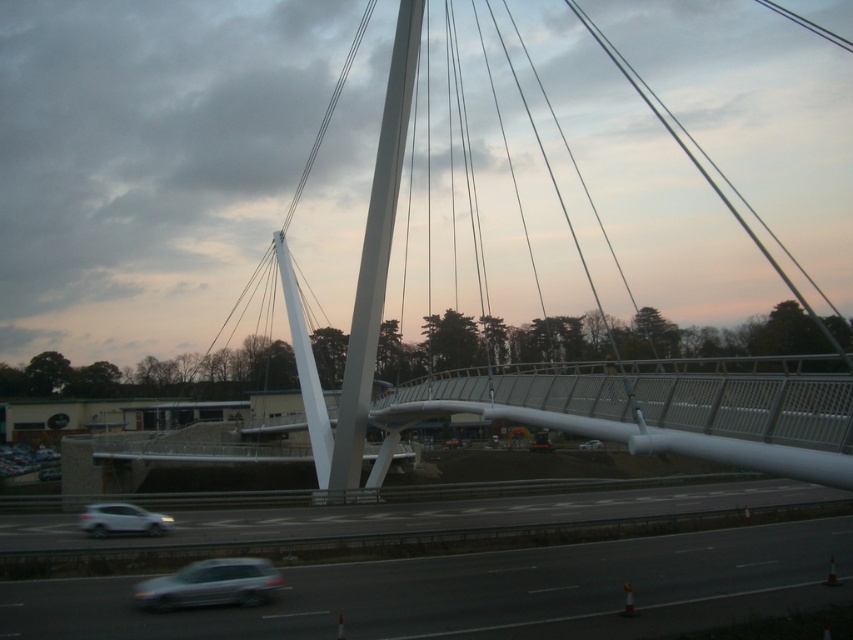
Question: Can you confirm if white glossy car at lower left is positioned above silver metallic car at center?

Choices:
 (A) yes
 (B) no

Answer: (B)

Question: In this image, where is satin silver car at lower center located relative to white glossy car at lower left?

Choices:
 (A) above
 (B) below

Answer: (A)

Question: Based on their relative distances, which object is farther from the silver metallic car at center?

Choices:
 (A) satin silver car at lower center
 (B) white glossy car at lower left
 (C) smooth asphalt highway at lower center

Answer: (B)

Question: Does satin silver car at lower center have a larger size compared to white glossy car at lower left?

Choices:
 (A) yes
 (B) no

Answer: (B)

Question: Considering the real-world distances, which object is closest to the white glossy car at lower left?

Choices:
 (A) satin silver car at lower center
 (B) silver metallic car at center

Answer: (A)

Question: Estimate the real-world distances between objects in this image. Which object is farther from the smooth asphalt highway at lower center?

Choices:
 (A) silver metallic car at center
 (B) satin silver car at lower center

Answer: (A)